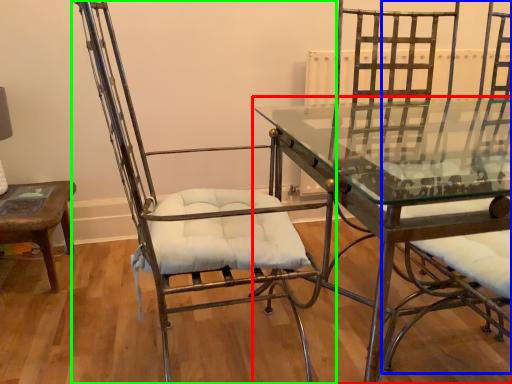
Question: Which object is the farthest from table (highlighted by a red box)? Choose among these: swivel chair (highlighted by a blue box) or chair (highlighted by a green box).

Choices:
 (A) swivel chair
 (B) chair

Answer: (A)